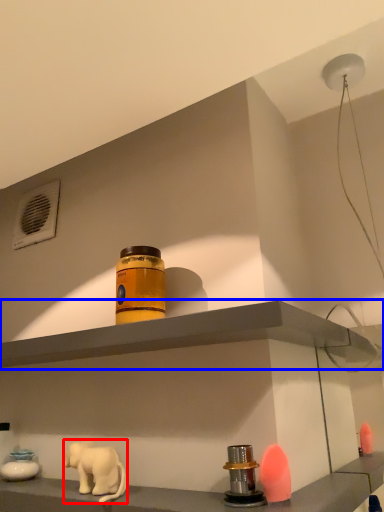
Question: Among these objects, which one is nearest to the camera, elephant (highlighted by a red box) or shelf (highlighted by a blue box)?

Choices:
 (A) elephant
 (B) shelf

Answer: (B)